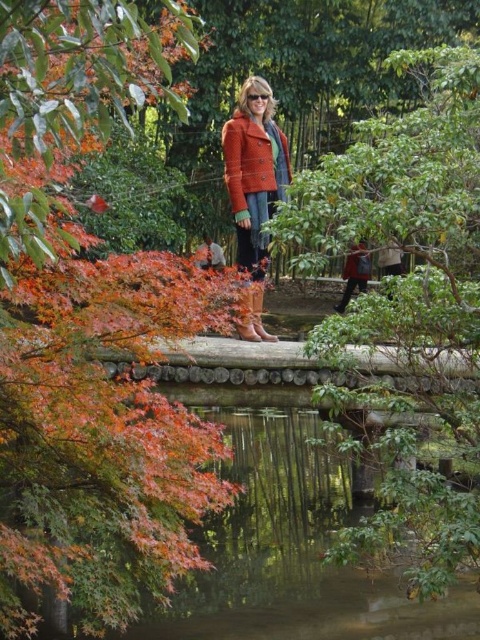
You are a photographer trying to capture the woman in the scene. You notice the matte orange coat at center and the light brown leather boots at center. Which item is located lower on her body?

The matte orange coat at center is positioned under the light brown leather boots at center, so the matte orange coat at center is lower on her body.

You are a photographer trying to capture the woman on the bridge. You have a camera with a zoom lens. You want to focus on the matte orange coat at center without the red fabric backpack at right appearing in the foreground. Is this possible?

The red fabric backpack at right is behind the matte orange coat at center, so focusing on the matte orange coat at center would place the red fabric backpack at right in the background, not the foreground. Therefore, the backpack won t obstruct the foreground view of the coat.

You are a photographer trying to capture the woman in the scene. You want to ensure that both the matte orange coat at center and the light brown leather boots at center are clearly visible in your shot. Based on their positions, which item might be partially obscured if you focus on the other?

The matte orange coat at center is in front of the light brown leather boots at center, so if you focus on the matte orange coat at center, the light brown leather boots at center might be partially obscured. Conversely, focusing on the light brown leather boots at center would likely keep both visible since the coat is in front.